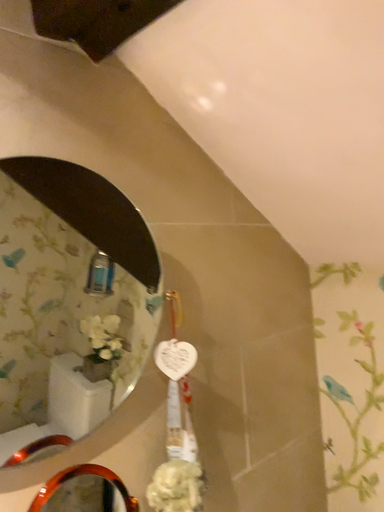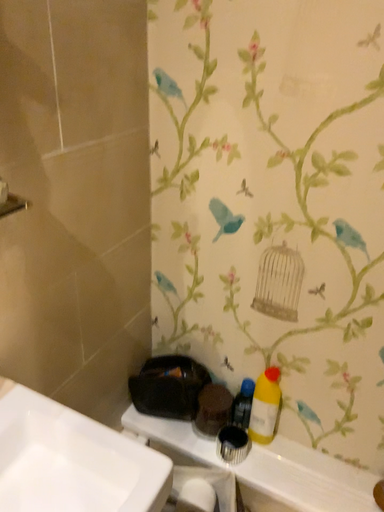
Question: How did the camera likely rotate when shooting the video?

Choices:
 (A) rotated right
 (B) rotated left

Answer: (A)